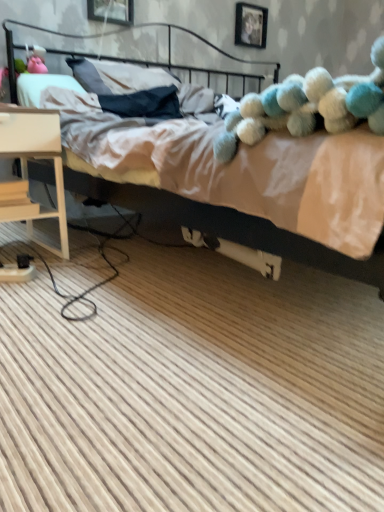
Image resolution: width=384 pixels, height=512 pixels. What do you see at coordinates (34, 158) in the screenshot?
I see `light wood nightstand at lower left` at bounding box center [34, 158].

You are a GUI agent. You are given a task and a screenshot of the screen. Output one action in this format:
    pyautogui.click(x=<x>, y=<y>)
    Task: Click on the fluffy blue and white teddy bear at upper right
    The image size is (384, 512).
    Given the screenshot: What is the action you would take?
    click(307, 106)

In order to click on beige fabric bed at upper center in this screenshot , I will do `click(285, 242)`.

Measure the distance between point [229,75] and camera.

The depth of point [229,75] is 9.29 feet.

Find the location of a particular element. This screenshot has height=512, width=384. light wood nightstand at lower left is located at coordinates (34, 158).

Which is closer, (58, 198) or (98, 34)?

Point (58, 198) appears to be closer to the viewer than point (98, 34).

In the image, is light wood nightstand at lower left on the left side or the right side of beige fabric bed at upper center?

In the image, light wood nightstand at lower left appears on the left side of beige fabric bed at upper center.

Can you confirm if light wood nightstand at lower left is thinner than beige fabric bed at upper center?

Correct, the width of light wood nightstand at lower left is less than that of beige fabric bed at upper center.

Is light wood nightstand at lower left facing towards beige fabric bed at upper center?

No, light wood nightstand at lower left is not aimed at beige fabric bed at upper center.

Consider the image. Which object is thinner, black metal headboard at upper center or fluffy blue and white teddy bear at upper right?

With smaller width is fluffy blue and white teddy bear at upper right.

Do you think black metal headboard at upper center is within fluffy blue and white teddy bear at upper right, or outside of it?

black metal headboard at upper center cannot be found inside fluffy blue and white teddy bear at upper right.

Is black metal headboard at upper center next to fluffy blue and white teddy bear at upper right and touching it?

No, black metal headboard at upper center is not with fluffy blue and white teddy bear at upper right.

Between black metal headboard at upper center and light wood nightstand at lower left, which one appears on the right side from the viewer's perspective?

black metal headboard at upper center is more to the right.

From a real-world perspective, relative to light wood nightstand at lower left, is black metal headboard at upper center vertically above or below?

black metal headboard at upper center is above light wood nightstand at lower left.

In the scene shown: Which is in front, black metal headboard at upper center or light wood nightstand at lower left?

Positioned in front is light wood nightstand at lower left.

Is black metal headboard at upper center far away from light wood nightstand at lower left?

black metal headboard at upper center is near light wood nightstand at lower left, not far away.

Measure the distance between beige fabric bed at upper center and light wood nightstand at lower left.

beige fabric bed at upper center and light wood nightstand at lower left are 34.89 inches apart from each other.

From a real-world perspective, which object rests below the other?

light wood nightstand at lower left is physically lower.

Is beige fabric bed at upper center surrounding light wood nightstand at lower left?

No, light wood nightstand at lower left is not inside beige fabric bed at upper center.

This screenshot has width=384, height=512. In order to click on nightstand on the left of beige fabric bed at upper center in this screenshot , I will do `click(34, 158)`.

Is fluffy blue and white teddy bear at upper right in front of or behind light wood nightstand at lower left in the image?

fluffy blue and white teddy bear at upper right is positioned closer to the viewer than light wood nightstand at lower left.

Could you tell me if fluffy blue and white teddy bear at upper right is facing light wood nightstand at lower left?

No, fluffy blue and white teddy bear at upper right does not turn towards light wood nightstand at lower left.

Is fluffy blue and white teddy bear at upper right taller or shorter than light wood nightstand at lower left?

Clearly, fluffy blue and white teddy bear at upper right is shorter compared to light wood nightstand at lower left.

Considering the sizes of objects fluffy blue and white teddy bear at upper right and beige fabric bed at upper center in the image provided, who is taller, fluffy blue and white teddy bear at upper right or beige fabric bed at upper center?

beige fabric bed at upper center is taller.

Between fluffy blue and white teddy bear at upper right and beige fabric bed at upper center, which one appears on the right side from the viewer's perspective?

beige fabric bed at upper center.

How many degrees apart are the facing directions of fluffy blue and white teddy bear at upper right and beige fabric bed at upper center?

They differ by 3.6 degrees in their facing directions.

Considering the relative sizes of fluffy blue and white teddy bear at upper right and beige fabric bed at upper center in the image provided, is fluffy blue and white teddy bear at upper right smaller than beige fabric bed at upper center?

Correct, fluffy blue and white teddy bear at upper right occupies less space than beige fabric bed at upper center.

Which point is more distant from viewer, (x=275, y=97) or (x=173, y=67)?

The point (x=173, y=67) is farther from the camera.

Is fluffy blue and white teddy bear at upper right aimed at black metal headboard at upper center?

No, fluffy blue and white teddy bear at upper right is not turned towards black metal headboard at upper center.

Can black metal headboard at upper center be found inside fluffy blue and white teddy bear at upper right?

No, black metal headboard at upper center is not a part of fluffy blue and white teddy bear at upper right.

Can you confirm if fluffy blue and white teddy bear at upper right is wider than black metal headboard at upper center?

In fact, fluffy blue and white teddy bear at upper right might be narrower than black metal headboard at upper center.

In the image, there is a beige fabric bed at upper center. Identify the location of nightstand below it (from a real-world perspective). (34, 158).

Find the location of a particular element. The height and width of the screenshot is (512, 384). headboard on the left of the fluffy blue and white teddy bear at upper right is located at coordinates (145, 59).

When comparing their distances from black metal headboard at upper center, does beige fabric bed at upper center or fluffy blue and white teddy bear at upper right seem closer?

Based on the image, beige fabric bed at upper center appears to be nearer to black metal headboard at upper center.

Looking at this image, from the image, which object appears to be nearer to fluffy blue and white teddy bear at upper right, light wood nightstand at lower left or beige fabric bed at upper center?

light wood nightstand at lower left is closer to fluffy blue and white teddy bear at upper right.

Based on their spatial positions, is light wood nightstand at lower left or fluffy blue and white teddy bear at upper right closer to beige fabric bed at upper center?

light wood nightstand at lower left is closer to beige fabric bed at upper center.

Considering their positions, is beige fabric bed at upper center positioned further to fluffy blue and white teddy bear at upper right than black metal headboard at upper center?

Based on the image, black metal headboard at upper center appears to be further to fluffy blue and white teddy bear at upper right.

When comparing their distances from beige fabric bed at upper center, does light wood nightstand at lower left or black metal headboard at upper center seem further?

The object further to beige fabric bed at upper center is light wood nightstand at lower left.

Which object lies further to the anchor point light wood nightstand at lower left, fluffy blue and white teddy bear at upper right or black metal headboard at upper center?

black metal headboard at upper center.

Which object lies further to the anchor point black metal headboard at upper center, fluffy blue and white teddy bear at upper right or beige fabric bed at upper center?

fluffy blue and white teddy bear at upper right is positioned further to the anchor black metal headboard at upper center.

When comparing their distances from beige fabric bed at upper center, does fluffy blue and white teddy bear at upper right or light wood nightstand at lower left seem further?

Based on the image, fluffy blue and white teddy bear at upper right appears to be further to beige fabric bed at upper center.

Find the location of a particular element. The image size is (384, 512). teddy positioned between beige fabric bed at upper center and black metal headboard at upper center from near to far is located at coordinates (307, 106).

The image size is (384, 512). I want to click on headboard between light wood nightstand at lower left and fluffy blue and white teddy bear at upper right from left to right, so click(145, 59).

Identify the location of teddy between light wood nightstand at lower left and beige fabric bed at upper center. This screenshot has width=384, height=512. [x=307, y=106].

Image resolution: width=384 pixels, height=512 pixels. I want to click on nightstand between beige fabric bed at upper center and black metal headboard at upper center along the z-axis, so click(34, 158).